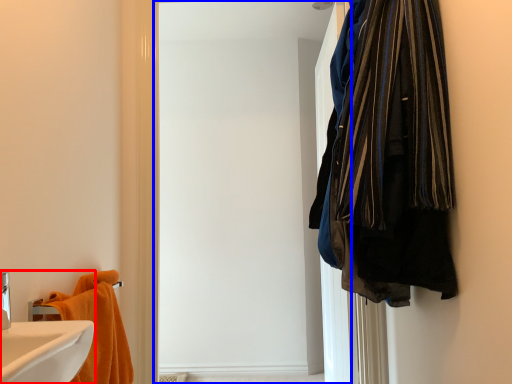
Question: Which object appears farthest to the camera in this image, bathroom cabinet (highlighted by a red box) or screen door (highlighted by a blue box)?

Choices:
 (A) bathroom cabinet
 (B) screen door

Answer: (B)